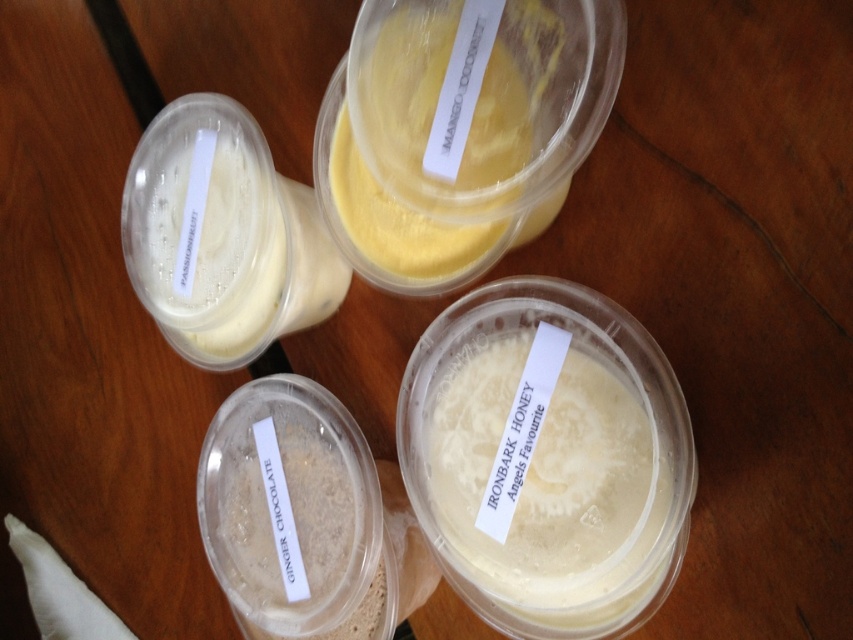
Who is positioned more to the left, white creamy milkshake at center or yellow matte jar at upper center?

Positioned to the left is yellow matte jar at upper center.

Does white creamy milkshake at center have a lesser width compared to yellow matte jar at upper center?

Yes.

Image resolution: width=853 pixels, height=640 pixels. What are the coordinates of `white creamy milkshake at center` in the screenshot? It's located at (548, 483).

Is point (579, 392) positioned before point (270, 164)?

That is True.

Consider the image. Who is positioned more to the left, white creamy milkshake at center or yellow matte jar at upper left?

yellow matte jar at upper left

The width and height of the screenshot is (853, 640). What are the coordinates of `white creamy milkshake at center` in the screenshot? It's located at (548, 483).

Who is more distant from viewer, (230,292) or (415,268)?

Positioned behind is point (230,292).

Between yellow matte jar at upper left and yellow matte jar at upper center, which one is positioned lower?

yellow matte jar at upper left is lower down.

Which is in front, point (178, 230) or point (491, 128)?

Point (491, 128) is in front.

This screenshot has height=640, width=853. What are the coordinates of `yellow matte jar at upper left` in the screenshot? It's located at (231, 253).